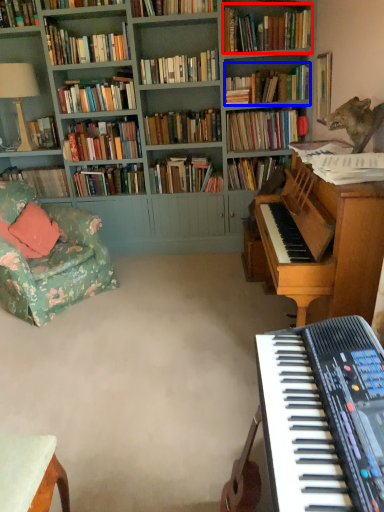
Question: Which object is closer to the camera taking this photo, book (highlighted by a red box) or book (highlighted by a blue box)?

Choices:
 (A) book
 (B) book

Answer: (A)